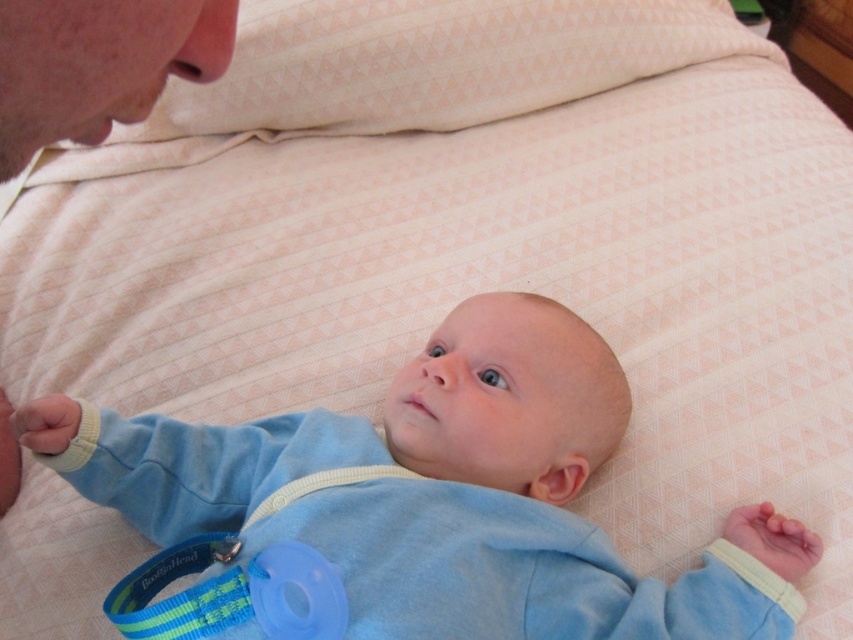
From the picture: Is pink textured pillow at upper center wider than blue rubber teething ring at lower center?

Indeed, pink textured pillow at upper center has a greater width compared to blue rubber teething ring at lower center.

Who is shorter, pink textured pillow at upper center or blue rubber teething ring at lower center?

blue rubber teething ring at lower center

The height and width of the screenshot is (640, 853). Describe the element at coordinates (436, 61) in the screenshot. I see `pink textured pillow at upper center` at that location.

Locate an element on the screen. The width and height of the screenshot is (853, 640). pink textured pillow at upper center is located at coordinates (436, 61).

In the scene shown: Does light blue soft fabric baby at center appear on the left side of pink textured pillow at upper center?

Yes, light blue soft fabric baby at center is to the left of pink textured pillow at upper center.

Which of these two, light blue soft fabric baby at center or pink textured pillow at upper center, stands shorter?

light blue soft fabric baby at center is shorter.

Image resolution: width=853 pixels, height=640 pixels. What do you see at coordinates (444, 492) in the screenshot?
I see `light blue soft fabric baby at center` at bounding box center [444, 492].

Identify the location of light blue soft fabric baby at center. (444, 492).

In the scene shown: Is the position of light blue soft fabric baby at center less distant than that of blue rubber teething ring at lower center?

Yes, light blue soft fabric baby at center is in front of blue rubber teething ring at lower center.

Who is higher up, light blue soft fabric baby at center or blue rubber teething ring at lower center?

Positioned higher is light blue soft fabric baby at center.

Between point (80, 461) and point (219, 561), which one is positioned in front?

Positioned in front is point (219, 561).

Where is `light blue soft fabric baby at center`? This screenshot has width=853, height=640. light blue soft fabric baby at center is located at coordinates (444, 492).